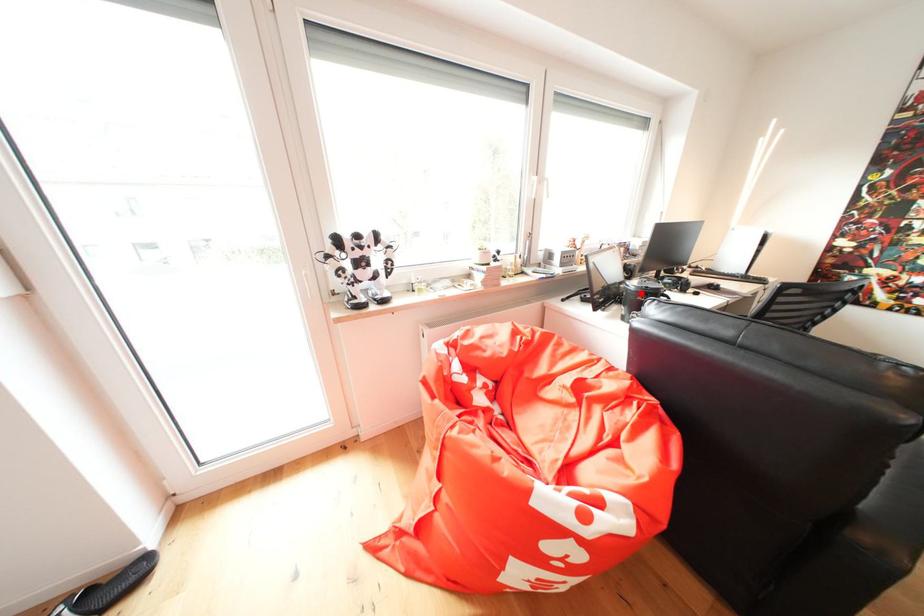
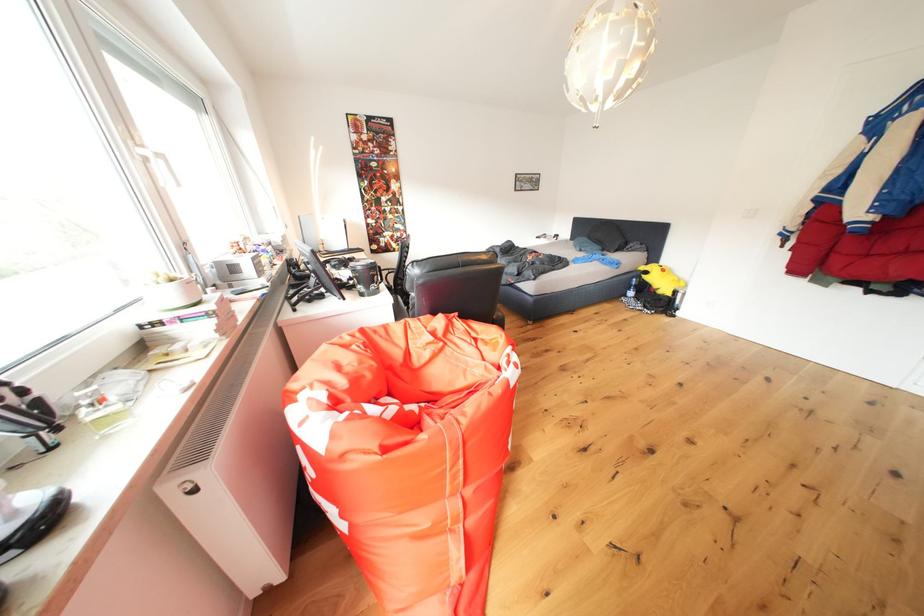
The point at the highlighted location is marked in the first image. Where is the corresponding point in the second image?

(369, 273)